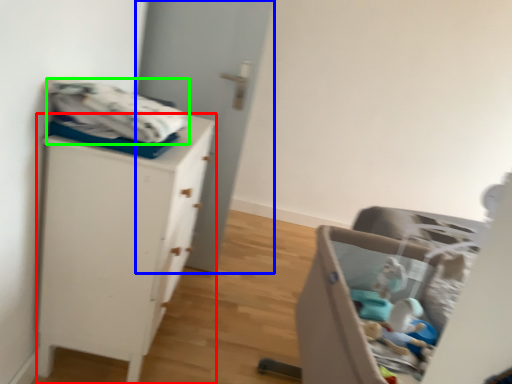
Question: Considering the real-world distances, which object is farthest from chest of drawers (highlighted by a red box)? door (highlighted by a blue box) or baby clothe (highlighted by a green box)?

Choices:
 (A) door
 (B) baby clothe

Answer: (A)